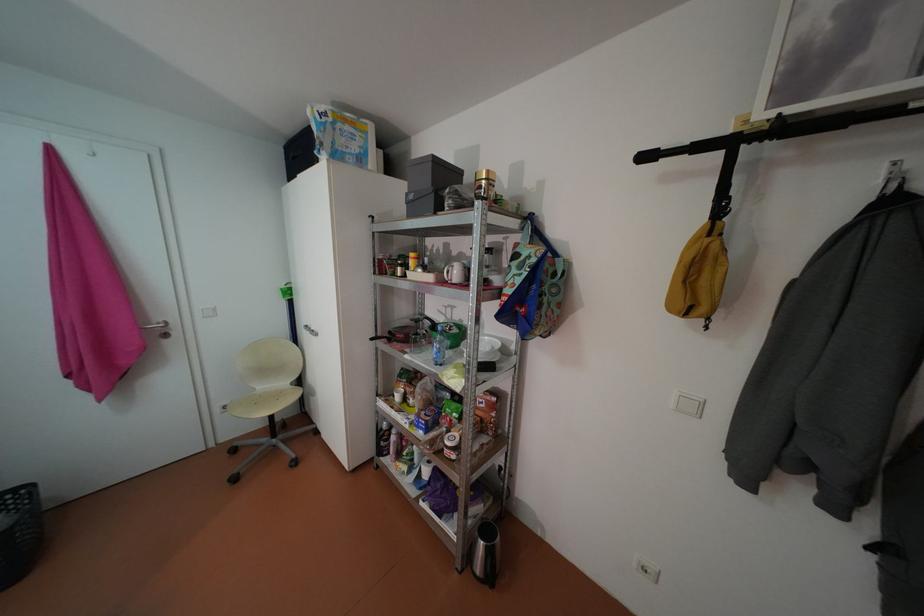
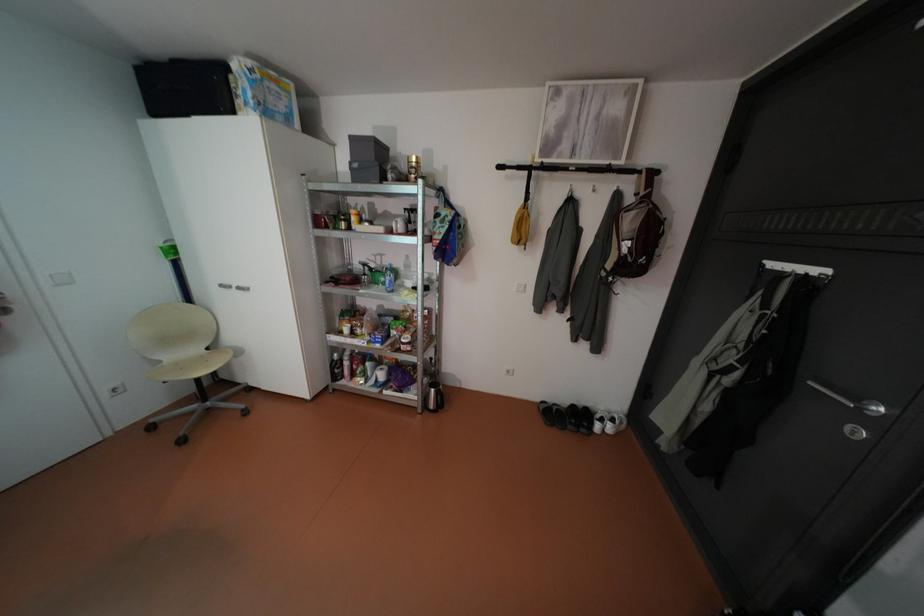
Find the pixel in the second image that matches point 363,148 in the first image.

(290, 107)